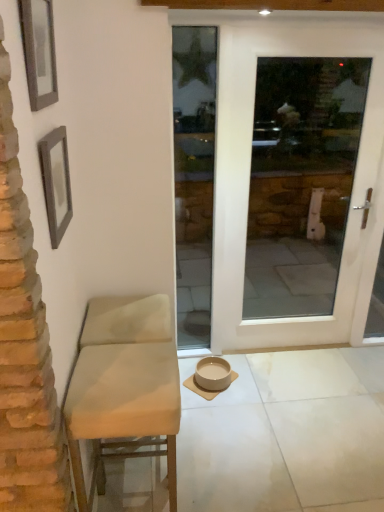
Question: Should I look upward or downward to see wooden picture frame at upper left, which is the second picture frame from bottom to top?

Choices:
 (A) up
 (B) down

Answer: (A)

Question: Considering the relative sizes of beige matte tile at center and beige ceramic bowl at center in the image provided, is beige matte tile at center wider than beige ceramic bowl at center?

Choices:
 (A) yes
 (B) no

Answer: (B)

Question: From the image's perspective, is beige matte tile at center over beige ceramic bowl at center?

Choices:
 (A) yes
 (B) no

Answer: (B)

Question: Is beige matte tile at center located outside beige ceramic bowl at center?

Choices:
 (A) yes
 (B) no

Answer: (B)

Question: Is beige matte tile at center bigger than beige ceramic bowl at center?

Choices:
 (A) no
 (B) yes

Answer: (A)

Question: Is beige ceramic bowl at center a part of beige matte tile at center?

Choices:
 (A) yes
 (B) no

Answer: (B)

Question: From a real-world perspective, is beige matte tile at center beneath beige ceramic bowl at center?

Choices:
 (A) yes
 (B) no

Answer: (A)

Question: Is gray textured frame at upper left, marked as the first picture frame in a bottom-to-top arrangement, outside of beige matte tile at center?

Choices:
 (A) no
 (B) yes

Answer: (B)

Question: Considering the relative sizes of gray textured frame at upper left, marked as the first picture frame in a bottom-to-top arrangement, and beige matte tile at center in the image provided, is gray textured frame at upper left, marked as the first picture frame in a bottom-to-top arrangement, smaller than beige matte tile at center?

Choices:
 (A) no
 (B) yes

Answer: (A)

Question: Is gray textured frame at upper left, the second picture frame when ordered from top to bottom, shorter than beige matte tile at center?

Choices:
 (A) yes
 (B) no

Answer: (B)

Question: Is gray textured frame at upper left, marked as the first picture frame in a bottom-to-top arrangement, at the right side of beige matte tile at center?

Choices:
 (A) yes
 (B) no

Answer: (B)

Question: From a real-world perspective, is gray textured frame at upper left, marked as the first picture frame in a bottom-to-top arrangement, on beige matte tile at center?

Choices:
 (A) yes
 (B) no

Answer: (A)

Question: From the image's perspective, does gray textured frame at upper left, the second picture frame when ordered from top to bottom, appear higher than beige matte tile at center?

Choices:
 (A) no
 (B) yes

Answer: (B)

Question: Is beige fabric chair at left shorter than beige matte tile at center?

Choices:
 (A) no
 (B) yes

Answer: (A)